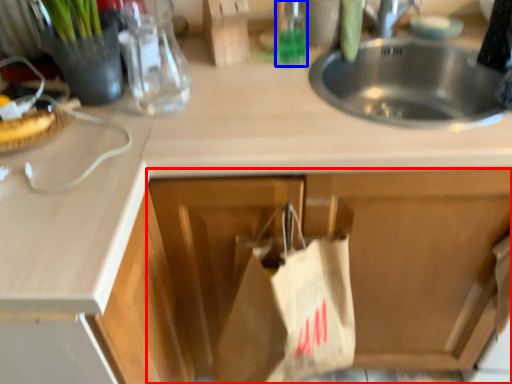
Question: Among these objects, which one is farthest to the camera, cabinetry (highlighted by a red box) or bottle (highlighted by a blue box)?

Choices:
 (A) cabinetry
 (B) bottle

Answer: (B)